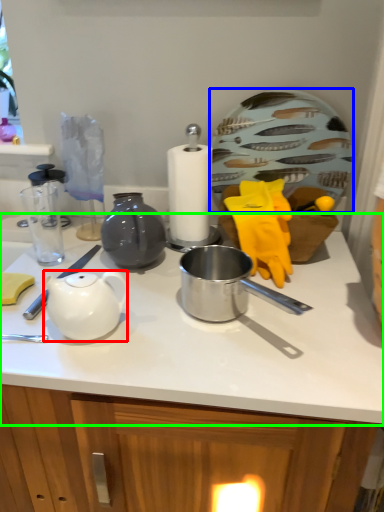
Question: Which object is positioned closest to teapot (highlighted by a red box)? Select from plate (highlighted by a blue box) and countertop (highlighted by a green box).

Choices:
 (A) plate
 (B) countertop

Answer: (B)